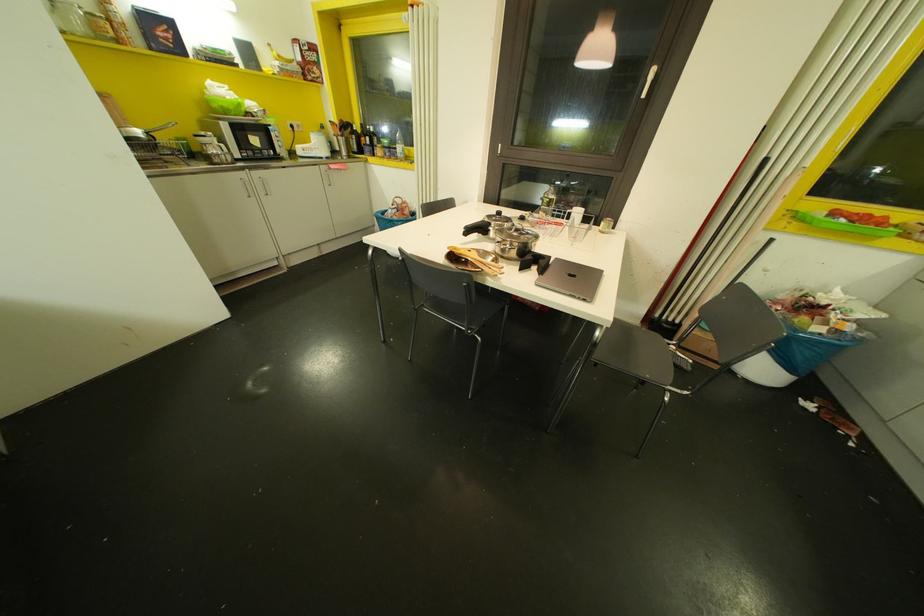
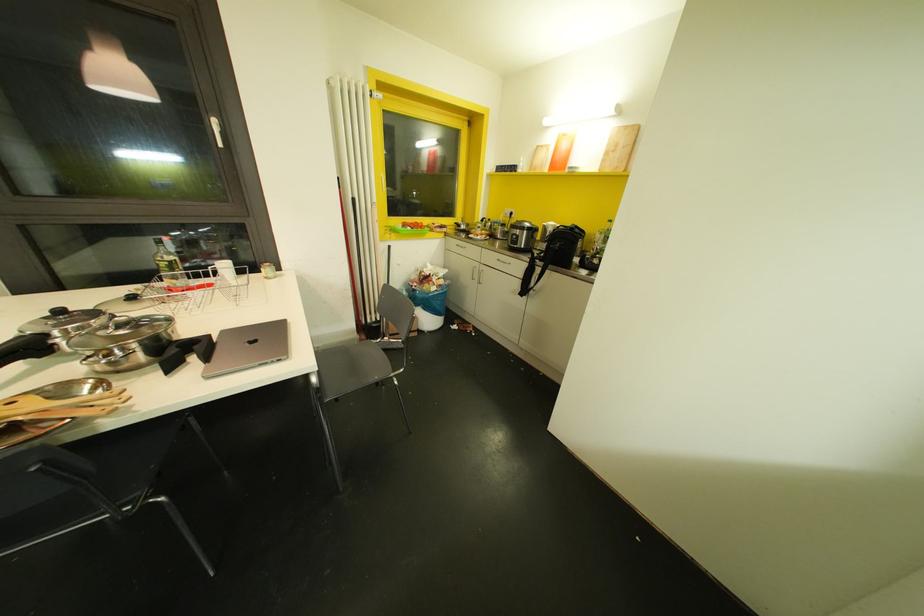
In the second image, find the point that corresponds to point (489, 224) in the first image.

(44, 334)